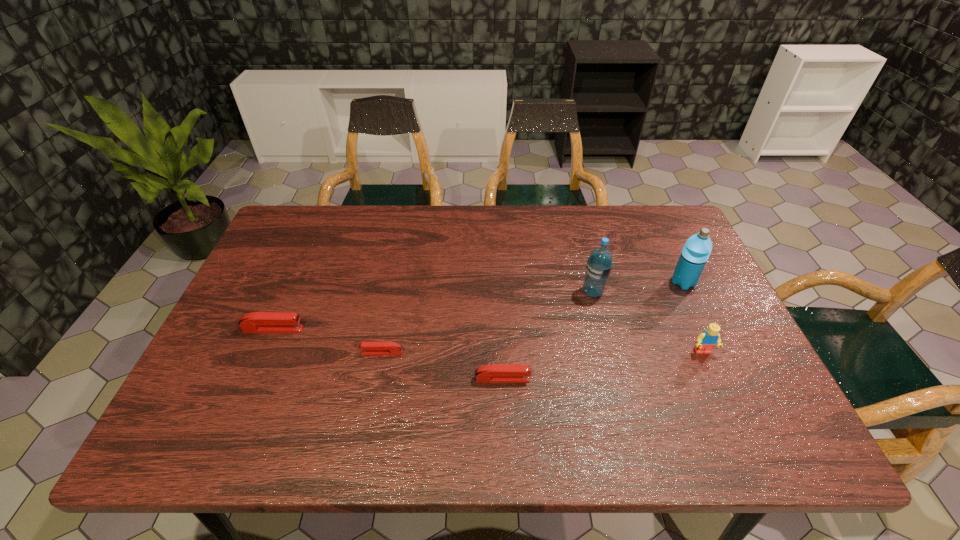
Identify the location of Lego positioned at the right edge. (708, 338).

Where is `vacant space at the far edge`? vacant space at the far edge is located at coordinates (363, 249).

Where is `vacant position at the near edge of the desktop`? The width and height of the screenshot is (960, 540). vacant position at the near edge of the desktop is located at coordinates [x=422, y=397].

In the image, there is a desktop. At what (x,y) coordinates should I click in order to perform the action: click on vacant space at the left edge. Please return your answer as a coordinate pair (x, y). This screenshot has width=960, height=540. Looking at the image, I should click on (261, 291).

The width and height of the screenshot is (960, 540). Identify the location of vacant space at the right edge. click(704, 288).

The image size is (960, 540). In the image, there is a desktop. What are the coordinates of `vacant space at the far left corner` in the screenshot? It's located at (293, 233).

The height and width of the screenshot is (540, 960). In order to click on vacant position at the far right corner of the desktop in this screenshot , I will do (x=647, y=217).

Image resolution: width=960 pixels, height=540 pixels. I want to click on vacant space in between the fifth object from right to left and the thermos bottle, so click(533, 318).

Locate an element on the screen. This screenshot has height=540, width=960. vacant space in between the fourth object from right to left and the fourth object from left to right is located at coordinates (547, 335).

Identify the location of blank region between the second shortest stapler and the Lego. The image size is (960, 540). (603, 365).